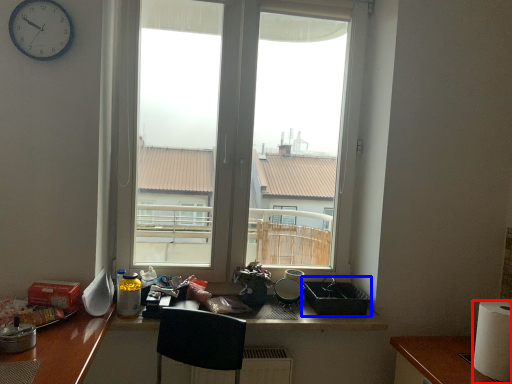
Question: Which object appears closest to the camera in this image, paper towel (highlighted by a red box) or appliance (highlighted by a blue box)?

Choices:
 (A) paper towel
 (B) appliance

Answer: (A)